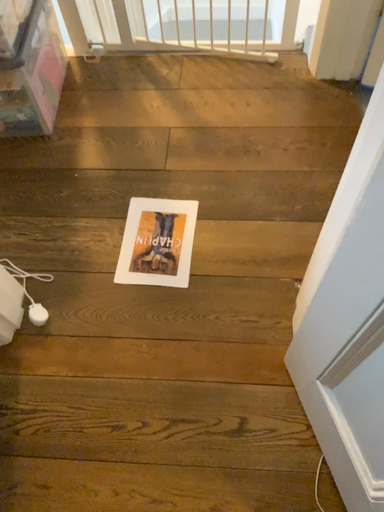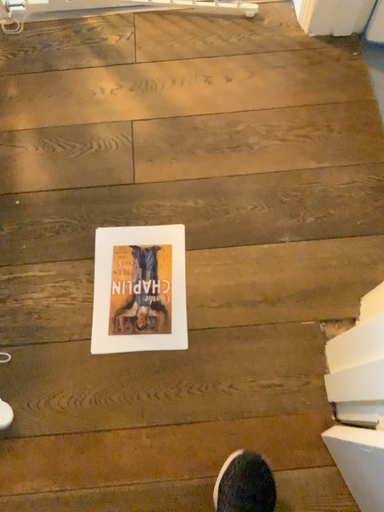
Question: Which way did the camera rotate in the video?

Choices:
 (A) rotated downward
 (B) rotated upward

Answer: (A)